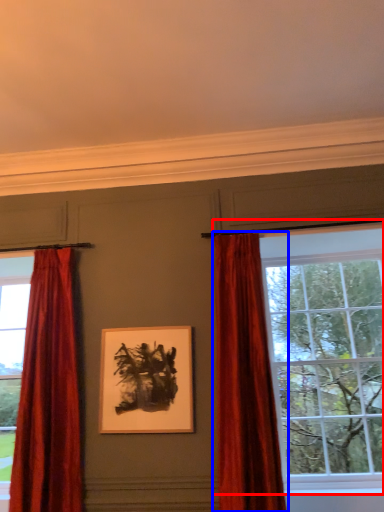
Question: Which of the following is the closest to the observer, window (highlighted by a red box) or curtain (highlighted by a blue box)?

Choices:
 (A) window
 (B) curtain

Answer: (B)